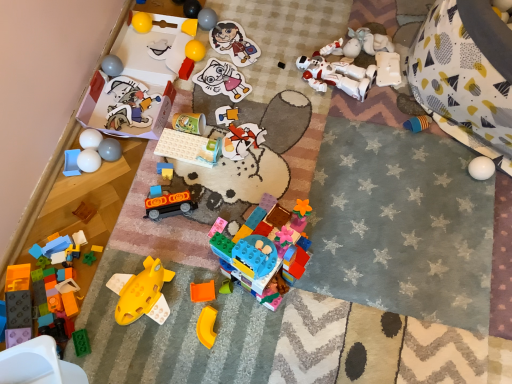
Where is `vacant space in between matte plastic sticker at upper center, which is the 20th toy from left to right, and matte plastic blocks at center, which appears as the fifteenth toy when viewed from the right`? Image resolution: width=512 pixels, height=384 pixels. vacant space in between matte plastic sticker at upper center, which is the 20th toy from left to right, and matte plastic blocks at center, which appears as the fifteenth toy when viewed from the right is located at coordinates (209, 94).